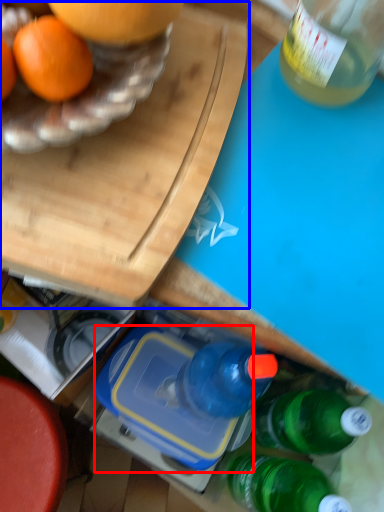
Question: Which object is closer to the camera taking this photo, lunch box (highlighted by a red box) or cutting board (highlighted by a blue box)?

Choices:
 (A) lunch box
 (B) cutting board

Answer: (B)